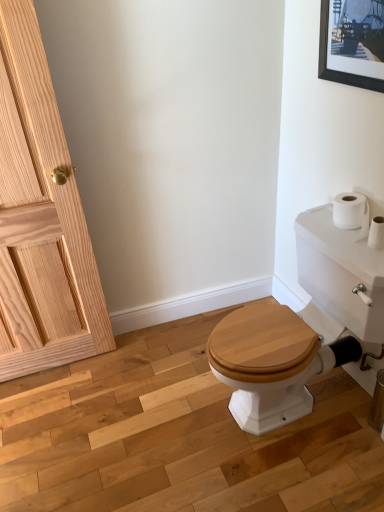
Where is `vacant area situated below natural wood door at left (from a real-world perspective)`? The image size is (384, 512). vacant area situated below natural wood door at left (from a real-world perspective) is located at coordinates (54, 370).